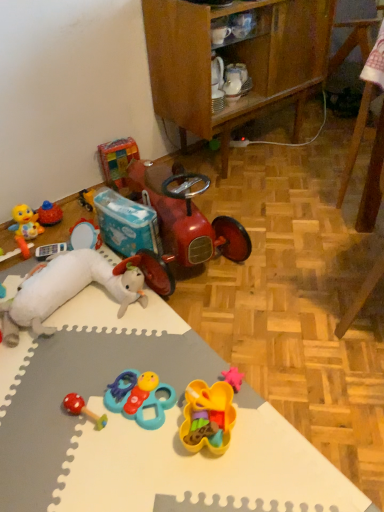
Where is `vacant space underneath wooden cabinet at center (from a real-world perspective)`? vacant space underneath wooden cabinet at center (from a real-world perspective) is located at coordinates (258, 148).